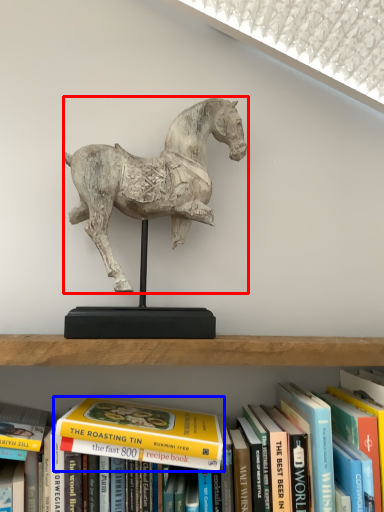
Question: Which point is further to the camera, horse (highlighted by a red box) or book (highlighted by a blue box)?

Choices:
 (A) horse
 (B) book

Answer: (A)